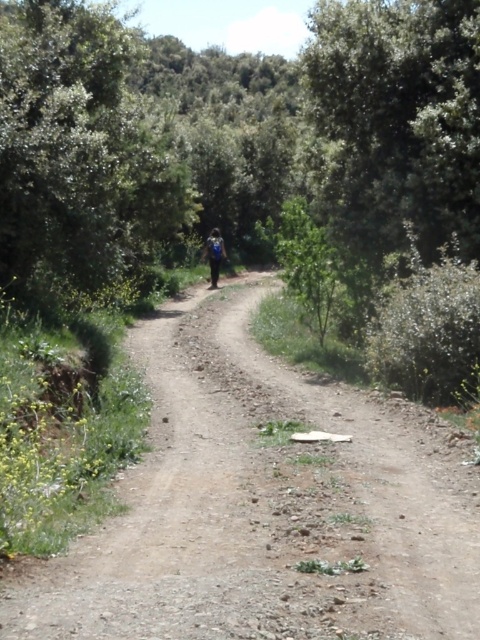
Is dirt road at center positioned behind green leafy tree at upper left?

That is False.

Between dirt road at center and green leafy tree at upper left, which one is positioned lower?

dirt road at center

Which is in front, point (350, 632) or point (76, 273)?

Point (350, 632) is in front.

This screenshot has width=480, height=640. In order to click on dirt road at center in this screenshot , I will do `click(264, 506)`.